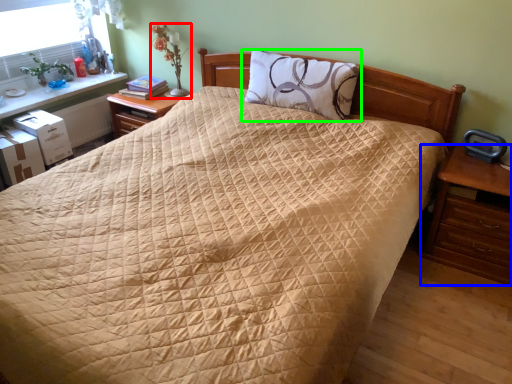
Question: Considering the real-world distances, which object is farthest from table lamp (highlighted by a red box)? nightstand (highlighted by a blue box) or pillow (highlighted by a green box)?

Choices:
 (A) nightstand
 (B) pillow

Answer: (A)